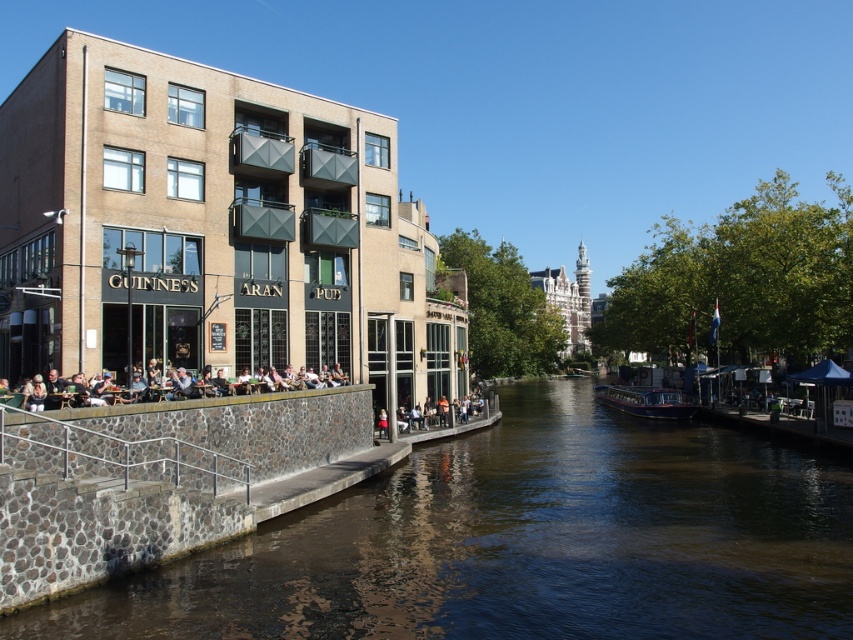
You are a tourist standing at the stainless steel railing at lower left, looking towards the brown stone river at center. Which direction should you walk to reach the river?

The brown stone river at center is positioned on the right side of the stainless steel railing at lower left, so you should walk to the right to reach the river.

Based on the photo, you are a tour guide leading a group along the canal path. You want to point out both the stainless steel railing at lower left and the Guinness Aran Pub on the left side of the image. How far apart are these two landmarks?

The stainless steel railing at lower left and the Guinness Aran Pub are 101.05 feet apart.